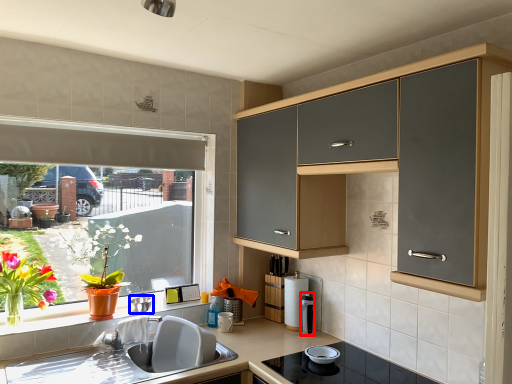
Question: Which object appears closest to the camera in this image, appliance (highlighted by a red box) or appliance (highlighted by a blue box)?

Choices:
 (A) appliance
 (B) appliance

Answer: (B)